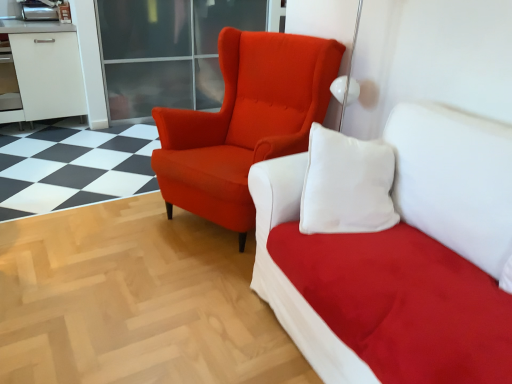
Question: Could you tell me if matte orange armchair at center is facing transparent glass door at upper center?

Choices:
 (A) no
 (B) yes

Answer: (A)

Question: Does matte orange armchair at center touch transparent glass door at upper center?

Choices:
 (A) yes
 (B) no

Answer: (B)

Question: Is matte orange armchair at center oriented away from transparent glass door at upper center?

Choices:
 (A) yes
 (B) no

Answer: (B)

Question: Does matte orange armchair at center appear on the left side of transparent glass door at upper center?

Choices:
 (A) yes
 (B) no

Answer: (B)

Question: From the image's perspective, does matte orange armchair at center appear lower than transparent glass door at upper center?

Choices:
 (A) yes
 (B) no

Answer: (A)

Question: Considering the relative positions of matte orange armchair at center and transparent glass door at upper center in the image provided, is matte orange armchair at center in front of transparent glass door at upper center?

Choices:
 (A) yes
 (B) no

Answer: (A)

Question: Does suede white studio couch at upper center have a lesser height compared to matte orange armchair at center?

Choices:
 (A) no
 (B) yes

Answer: (B)

Question: From the image's perspective, is suede white studio couch at upper center below matte orange armchair at center?

Choices:
 (A) no
 (B) yes

Answer: (B)

Question: Does suede white studio couch at upper center appear on the right side of matte orange armchair at center?

Choices:
 (A) no
 (B) yes

Answer: (B)

Question: Is suede white studio couch at upper center not near matte orange armchair at center?

Choices:
 (A) no
 (B) yes

Answer: (A)

Question: Is the depth of suede white studio couch at upper center less than that of matte orange armchair at center?

Choices:
 (A) yes
 (B) no

Answer: (A)

Question: Is suede white studio couch at upper center thinner than matte orange armchair at center?

Choices:
 (A) yes
 (B) no

Answer: (B)

Question: Is matte orange armchair at center placed right next to suede white studio couch at upper center?

Choices:
 (A) yes
 (B) no

Answer: (B)